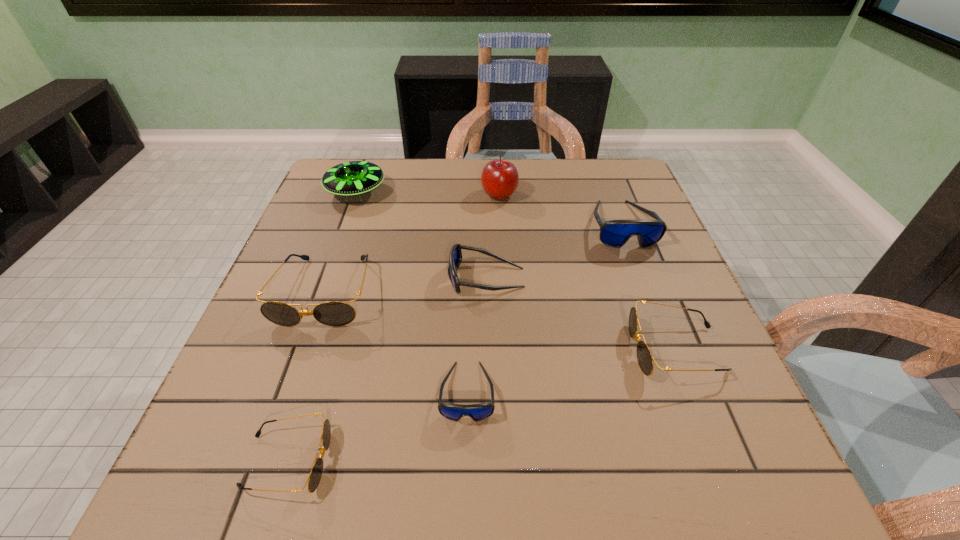
This screenshot has height=540, width=960. Identify the location of pink apple. (499, 178).

Find the location of `apple`. apple is located at coordinates (499, 178).

I want to click on green saucer, so click(x=352, y=178).

Identify the location of the farthest blue sunglasses. This screenshot has width=960, height=540. (615, 233).

I want to click on the rightmost blue sunglasses, so click(615, 233).

Image resolution: width=960 pixels, height=540 pixels. Find the location of `the biggest black sunglasses`. the biggest black sunglasses is located at coordinates (333, 313).

Image resolution: width=960 pixels, height=540 pixels. I want to click on the second smallest blue sunglasses, so click(x=455, y=258).

This screenshot has width=960, height=540. In order to click on the second biggest black sunglasses in this screenshot , I will do `click(644, 356)`.

The height and width of the screenshot is (540, 960). What are the coordinates of `the smallest blue sunglasses` in the screenshot? It's located at (477, 412).

Image resolution: width=960 pixels, height=540 pixels. Identify the location of the shortest object. (314, 478).